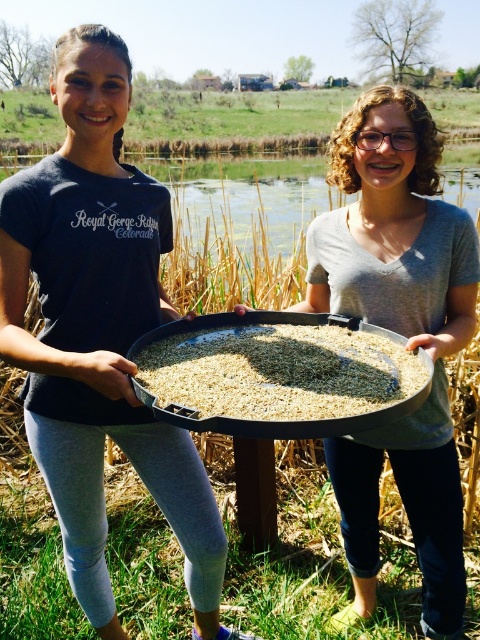
Is matte black tray at left thinner than brown matte rice at center?

No, matte black tray at left is not thinner than brown matte rice at center.

Is matte black tray at left shorter than brown matte rice at center?

In fact, matte black tray at left may be taller than brown matte rice at center.

Between point (111, 84) and point (330, 419), which one is positioned behind?

Positioned behind is point (111, 84).

Locate an element on the screen. This screenshot has height=640, width=480. matte black tray at left is located at coordinates click(x=99, y=332).

Does matte black tray at left appear under matte gray tray at center?

No.

Does matte black tray at left have a greater height compared to matte gray tray at center?

Yes, matte black tray at left is taller than matte gray tray at center.

Who is more forward, (x=85, y=436) or (x=348, y=115)?

Positioned in front is point (x=85, y=436).

Where is `matte black tray at left`? The height and width of the screenshot is (640, 480). matte black tray at left is located at coordinates (99, 332).

Does matte gray tray at center have a greater height compared to brown matte rice at center?

Correct, matte gray tray at center is much taller as brown matte rice at center.

Between matte gray tray at center and brown matte rice at center, which one appears on the right side from the viewer's perspective?

Positioned to the right is matte gray tray at center.

Find the location of a particular element. matte gray tray at center is located at coordinates (400, 333).

Image resolution: width=480 pixels, height=640 pixels. Identify the location of matte gray tray at center. 400,333.